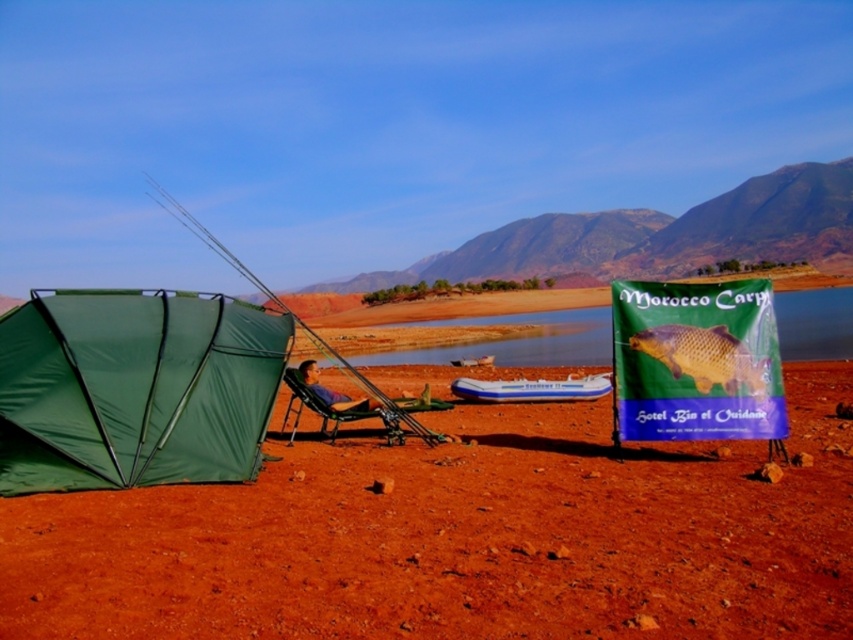
Looking at this image, you are planning to set up a picnic area between the green fabric tent at left and the blue inflatable boat at center. Based on their positions, which object should you place your picnic blanket closer to if you want it exactly halfway between them?

The picnic blanket should be placed exactly halfway between the green fabric tent at left and the blue inflatable boat at center. Since the green fabric tent at left is to the left of the blue inflatable boat at center, the midpoint would be closer to the boat.

You are a hiker who wants to place a 1.5 meter long tent pole between the dirt field at lower center and the golden textured fish at center. Can the pole fit between them without overlapping either object?

The distance between the dirt field at lower center and the golden textured fish at center is 1.5 meters. Since the pole is 1.5 meters long, it can fit between them without overlapping either object.